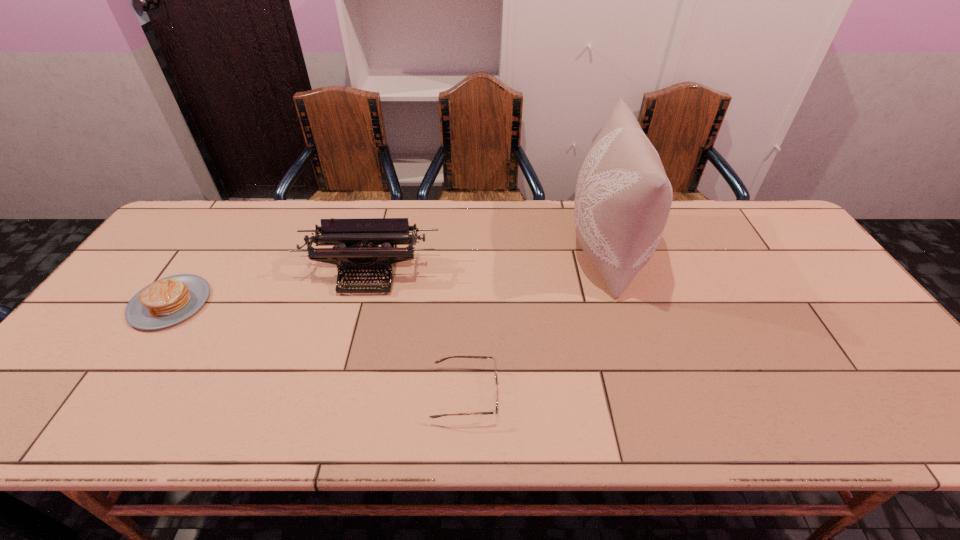
You are a GUI agent. You are given a task and a screenshot of the screen. Output one action in this format:
    pyautogui.click(x=<x>, y=<y>)
    Task: Click on the blank space located 0.380m on the typing side of the third shortest object
    The width and height of the screenshot is (960, 540).
    Given the screenshot: What is the action you would take?
    pyautogui.click(x=329, y=428)

You are a GUI agent. You are given a task and a screenshot of the screen. Output one action in this format:
    pyautogui.click(x=<x>, y=<y>)
    Task: Click on the vacant area situated on the right of the leftmost object
    
    Given the screenshot: What is the action you would take?
    pyautogui.click(x=238, y=303)

The image size is (960, 540). Identify the location of blank space located on the front-facing side of the nearest object. [x=612, y=394].

At what (x,y) coordinates should I click in order to perform the action: click on object present at the far edge. Please return your answer as a coordinate pair (x, y). The height and width of the screenshot is (540, 960). Looking at the image, I should click on (623, 197).

Where is `object that is at the near edge`? This screenshot has height=540, width=960. object that is at the near edge is located at coordinates (496, 395).

At what (x,y) coordinates should I click in order to perform the action: click on object that is at the left edge. Please return your answer as a coordinate pair (x, y). This screenshot has width=960, height=540. Looking at the image, I should click on (170, 300).

The width and height of the screenshot is (960, 540). In order to click on vacant space at the far edge of the desktop in this screenshot , I will do `click(439, 231)`.

In the image, there is a desktop. Identify the location of vacant space at the near edge. (683, 404).

Identify the location of vacant region at the right edge of the desktop. Image resolution: width=960 pixels, height=540 pixels. (818, 285).

This screenshot has height=540, width=960. What are the coordinates of `vacant region at the far left corner of the desktop` in the screenshot? It's located at (210, 215).